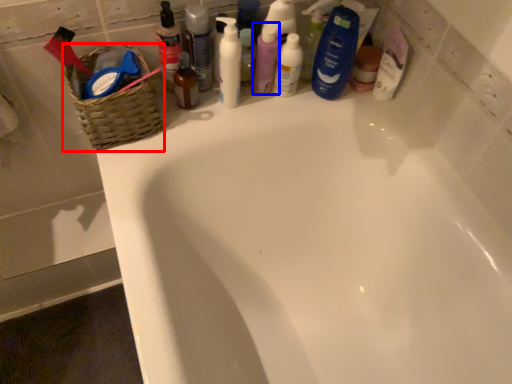
Question: Which of the following is the farthest to the observer, basket (highlighted by a red box) or toiletry (highlighted by a blue box)?

Choices:
 (A) basket
 (B) toiletry

Answer: (B)